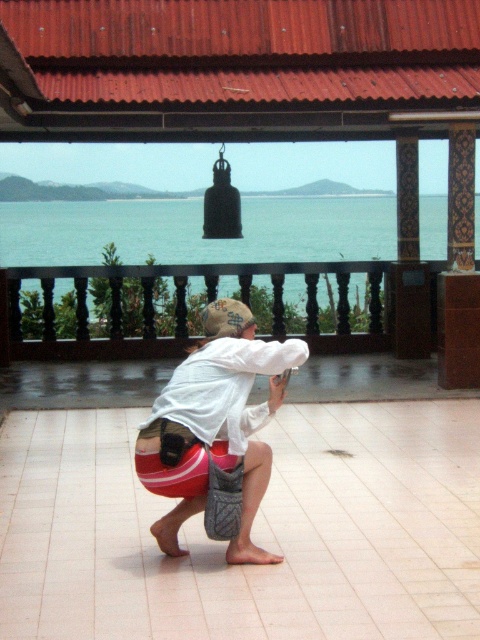
Question: Is blue water at center bigger than red fabric bag at center?

Choices:
 (A) no
 (B) yes

Answer: (B)

Question: Is blue water at center smaller than red fabric bag at center?

Choices:
 (A) yes
 (B) no

Answer: (B)

Question: Which point is farther to the camera?

Choices:
 (A) red fabric bag at center
 (B) blue water at center

Answer: (B)

Question: Which of the following is the closest to the observer?

Choices:
 (A) (121, 252)
 (B) (268, 362)

Answer: (B)

Question: Can you confirm if blue water at center is positioned to the right of red fabric bag at center?

Choices:
 (A) yes
 (B) no

Answer: (A)